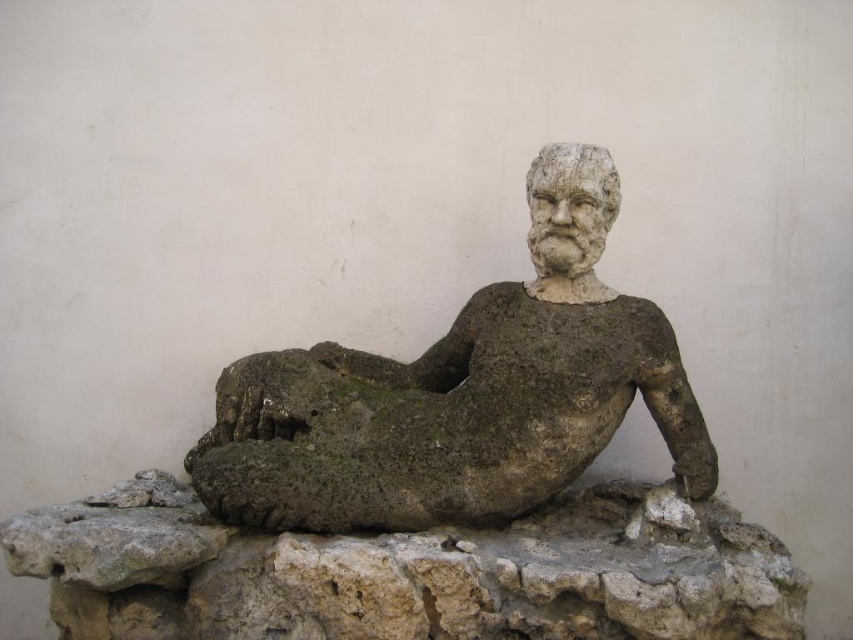
You are an art conservator assessing the sculpture. You need to determine if the gray stone reclining figure at center is taller than the gray stone at center. Based on the description, what can you conclude?

The gray stone reclining figure at center has a greater height compared to the gray stone at center, so it is taller.

You are an art conservator assessing the space requirements for transporting two gray stone objects from the image. The first is the gray stone reclining figure at center, and the second is the gray stone at center. Which object requires a wider space for transportation?

The gray stone at center requires a wider space for transportation because its width is greater than the gray stone reclining figure at center.